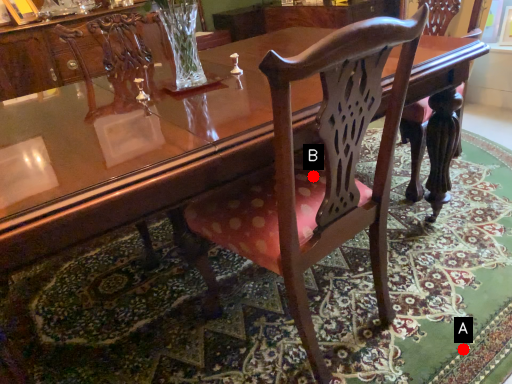
Question: Two points are circled on the image, labeled by A and B beside each circle. Which point is closer to the camera?

Choices:
 (A) A is closer
 (B) B is closer

Answer: (A)